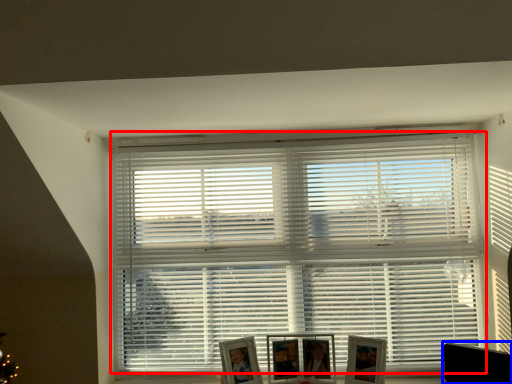
Question: Which of the following is the farthest to the observer, window blind (highlighted by a red box) or swivel chair (highlighted by a blue box)?

Choices:
 (A) window blind
 (B) swivel chair

Answer: (A)